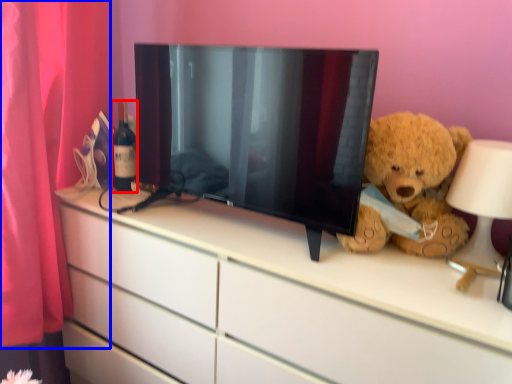
Question: Which object appears farthest to the camera in this image, bottle (highlighted by a red box) or curtain (highlighted by a blue box)?

Choices:
 (A) bottle
 (B) curtain

Answer: (A)